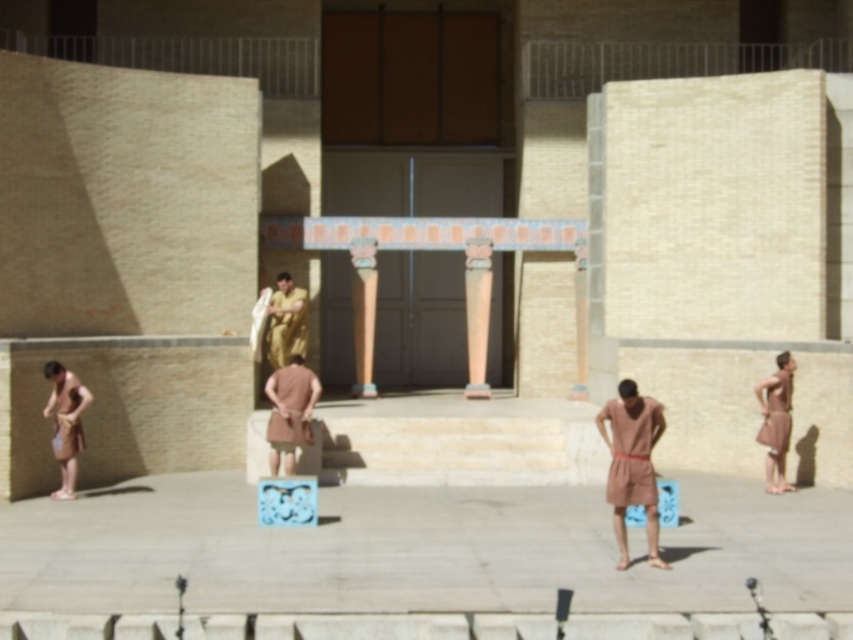
Which is behind, point (619, 532) or point (270, 326)?

Point (270, 326)

Who is more distant from viewer, (x=648, y=541) or (x=292, y=328)?

The point (x=292, y=328) is more distant.

You are a GUI agent. You are given a task and a screenshot of the screen. Output one action in this format:
    pyautogui.click(x=<x>, y=<y>)
    Task: Click on the brown cloth at center
    The width and height of the screenshot is (853, 640).
    Given the screenshot: What is the action you would take?
    (x=631, y=464)

Does point (479, 243) come farther from viewer compared to point (770, 422)?

Yes, point (479, 243) is farther from viewer.

Is point (489, 266) positioned after point (767, 422)?

Yes, it is.

Where is `smooth beige column at center`? smooth beige column at center is located at coordinates (477, 314).

Consider the image. Between brown cloth at center and smooth beige column at center, which one appears on the left side from the viewer's perspective?

smooth beige column at center

Is brown cloth at center to the left of smooth beige column at center from the viewer's perspective?

Incorrect, brown cloth at center is not on the left side of smooth beige column at center.

Which is behind, point (625, 438) or point (485, 289)?

Positioned behind is point (485, 289).

At what (x,y) coordinates should I click in order to perform the action: click on brown cloth at center. Please return your answer as a coordinate pair (x, y). The height and width of the screenshot is (640, 853). Looking at the image, I should click on (631, 464).